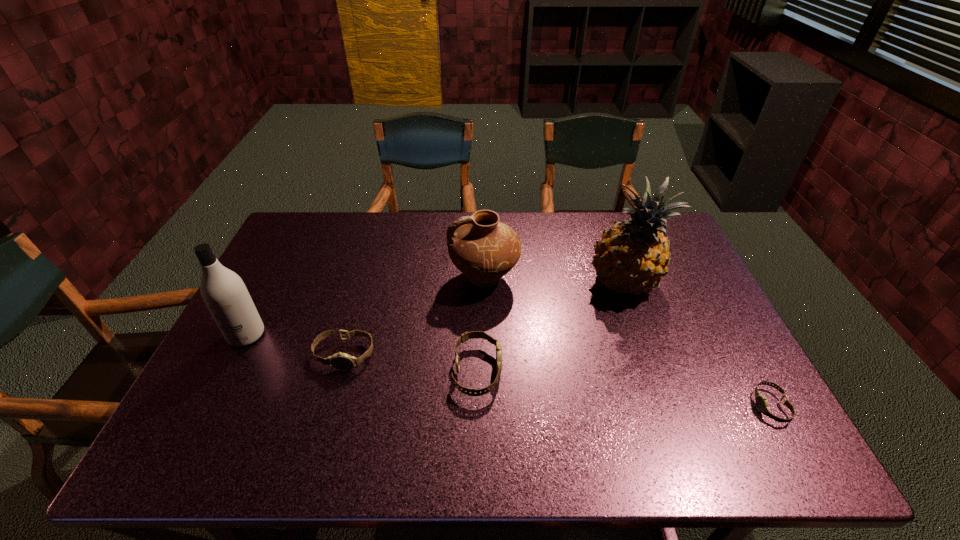
The height and width of the screenshot is (540, 960). In order to click on free space located on the face of the second watch from right to left in this screenshot , I will do `click(574, 371)`.

Identify the location of vacant space located on the face of the rightmost watch. (720, 406).

This screenshot has height=540, width=960. Identify the location of vacant space positioned 0.310m on the face of the rightmost watch. (621, 406).

This screenshot has width=960, height=540. I want to click on vacant space located 0.270m on the face of the rightmost watch, so click(638, 406).

This screenshot has width=960, height=540. What are the coordinates of `vacant space positioned on the side of the fourth shortest object with the handle` in the screenshot? It's located at (338, 278).

This screenshot has height=540, width=960. What are the coordinates of `free space located 0.220m on the side of the fourth shortest object with the handle` in the screenshot? It's located at (377, 278).

You are a GUI agent. You are given a task and a screenshot of the screen. Output one action in this format:
    pyautogui.click(x=<x>, y=<y>)
    Task: Click on the free space located on the side of the fourth shortest object with the handle
    The height and width of the screenshot is (540, 960).
    Given the screenshot: What is the action you would take?
    pyautogui.click(x=331, y=278)

You are a GUI agent. You are given a task and a screenshot of the screen. Output one action in this format:
    pyautogui.click(x=<x>, y=<y>)
    Task: Click on the free spot located 0.170m on the front-facing side of the fifth shortest object
    This screenshot has width=960, height=540.
    Given the screenshot: What is the action you would take?
    pyautogui.click(x=209, y=408)

This screenshot has height=540, width=960. I want to click on free region located 0.130m on the front of the pineapple, so click(x=645, y=345).

Where is `object that is at the left edge`? object that is at the left edge is located at coordinates (225, 295).